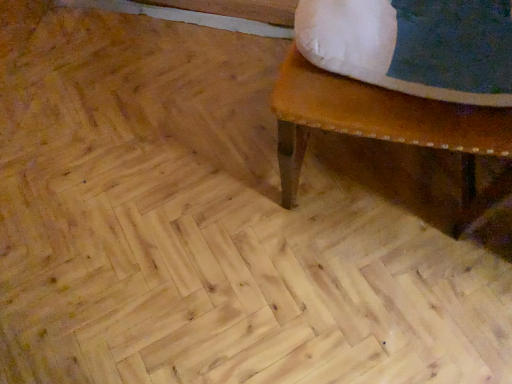
In order to click on brown wooden bench at upper right in this screenshot , I will do `click(399, 80)`.

The image size is (512, 384). What do you see at coordinates (399, 80) in the screenshot?
I see `brown wooden bench at upper right` at bounding box center [399, 80].

Measure the distance between brown wooden bench at upper right and camera.

brown wooden bench at upper right and camera are 55.14 centimeters apart.

Locate an element on the screen. Image resolution: width=512 pixels, height=384 pixels. brown wooden bench at upper right is located at coordinates (399, 80).